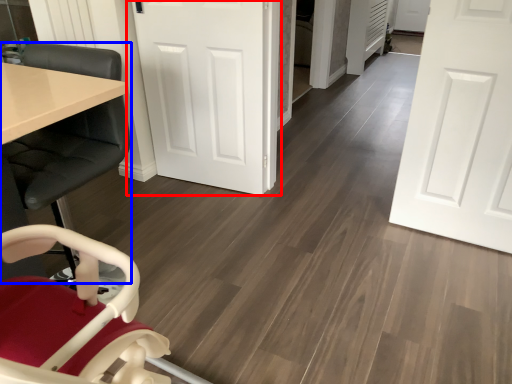
Question: Among these objects, which one is farthest to the camera, door (highlighted by a red box) or chair (highlighted by a blue box)?

Choices:
 (A) door
 (B) chair

Answer: (A)